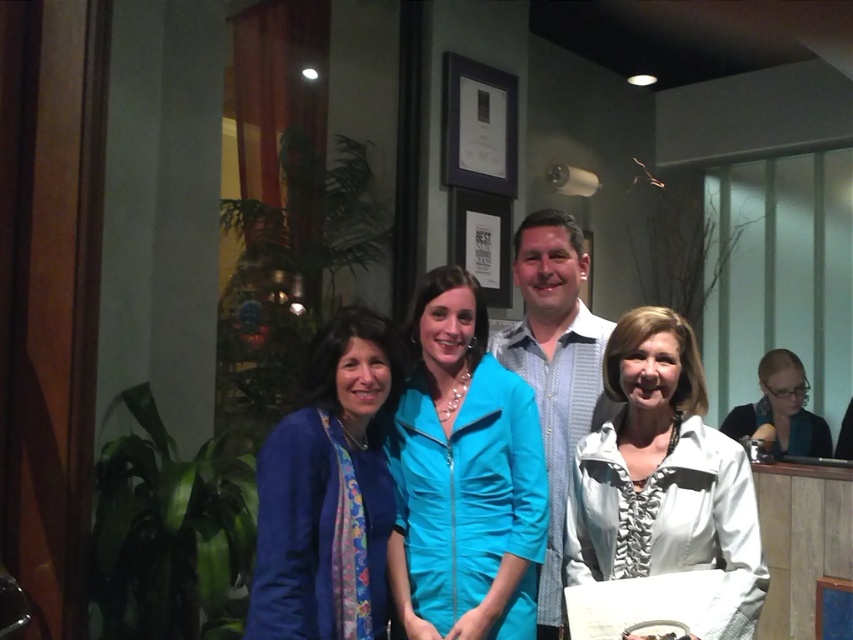
You are standing at the entrance of the room and want to locate the turquoise fabric jacket at center. According to the coordinates provided, in which direction should you look relative to your current position?

The turquoise fabric jacket at center is located at coordinates point (463,476), which is to the right and slightly forward from your position at the entrance.